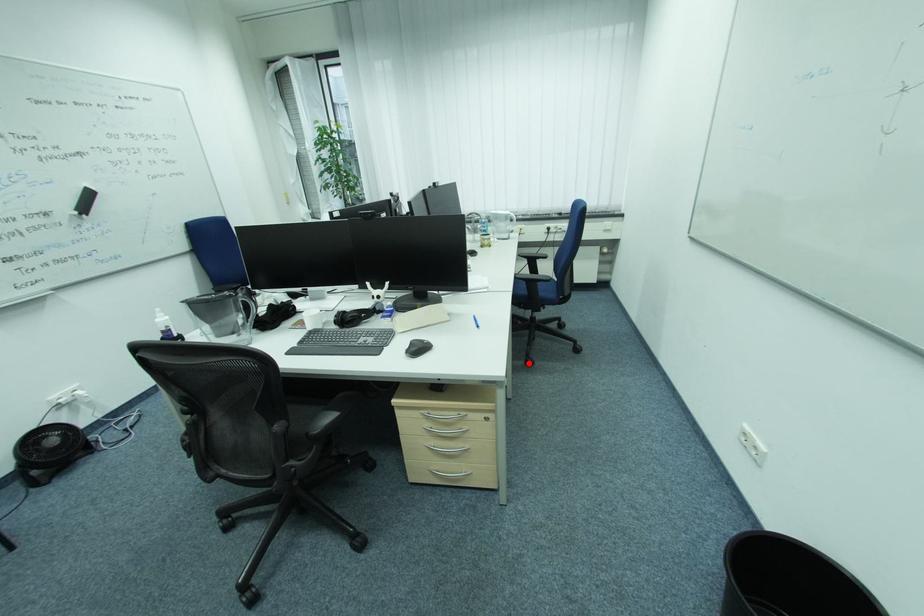
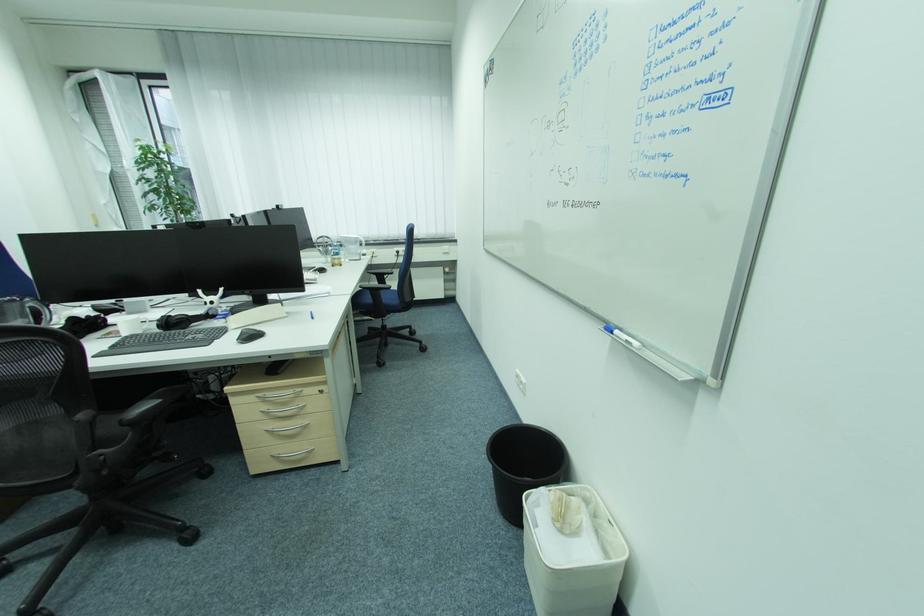
Question: I am providing you with two images of the same scene from different viewpoints. A red point is shown in image1. For the corresponding object point in image2, is it positioned nearer or farther from the camera?

Choices:
 (A) Nearer
 (B) Farther

Answer: (A)